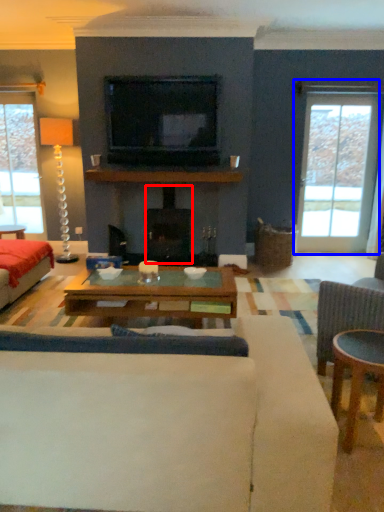
Question: Which object is closer to the camera taking this photo, fireplace (highlighted by a red box) or window (highlighted by a blue box)?

Choices:
 (A) fireplace
 (B) window

Answer: (A)